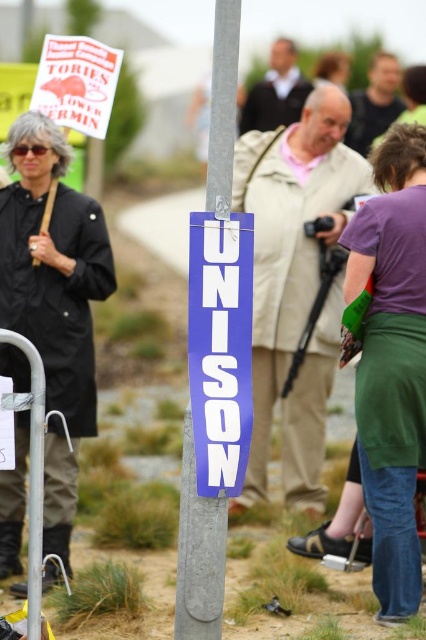
Question: Does black matte coat at left appear under purple vinyl banner at center?

Choices:
 (A) yes
 (B) no

Answer: (A)

Question: From the image, what is the correct spatial relationship of black matte coat at left in relation to purple fabric skirt at lower right?

Choices:
 (A) left
 (B) right

Answer: (A)

Question: Considering the real-world distances, which object is farthest from the metallic gray pole at center?

Choices:
 (A) purple fabric skirt at lower right
 (B) black matte coat at left

Answer: (B)

Question: Which of the following is the closest to the observer?

Choices:
 (A) metallic gray pole at center
 (B) purple vinyl banner at center

Answer: (A)

Question: Which object is farther from the camera taking this photo?

Choices:
 (A) metallic gray pole at center
 (B) purple fabric skirt at lower right
 (C) black matte coat at left
 (D) purple vinyl banner at center

Answer: (C)

Question: Can you confirm if black matte coat at left is bigger than purple fabric skirt at lower right?

Choices:
 (A) no
 (B) yes

Answer: (B)